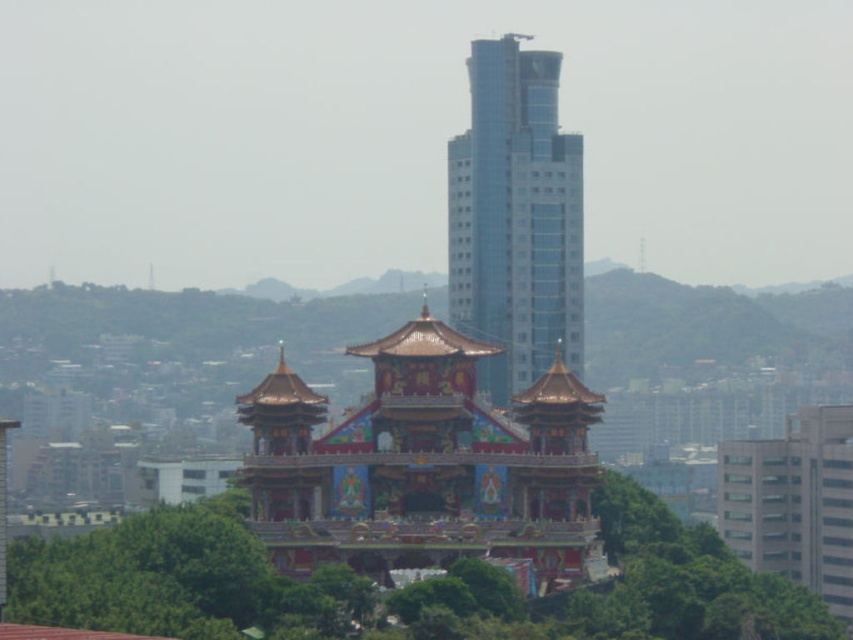
You are standing at point (178, 579) in the urban landscape. What can you see around you?

At point (178, 579) lies green leafy tree at center.

You are a drone operator tasked with flying a drone between the green leafy tree at center and the glassy blue skyscraper at center. The drone has a maximum flight distance of 50 meters. Can the drone safely complete the flight without exceeding its range?

The distance between the green leafy tree at center and the glassy blue skyscraper at center is 51.54 meters. Since the drone has a maximum flight distance of 50 meters, it cannot safely complete the flight without exceeding its range.